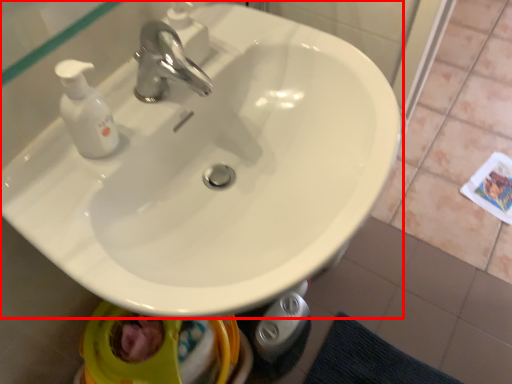
Question: Where is sink (annotated by the red box) located in relation to tap in the image?

Choices:
 (A) right
 (B) left

Answer: (A)